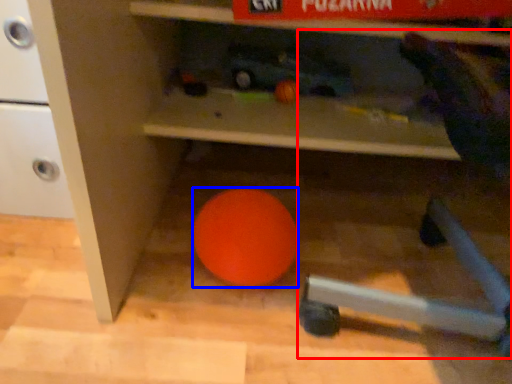
Question: Which point is further to the camera, bean bag chair (highlighted by a red box) or ball (highlighted by a blue box)?

Choices:
 (A) bean bag chair
 (B) ball

Answer: (B)